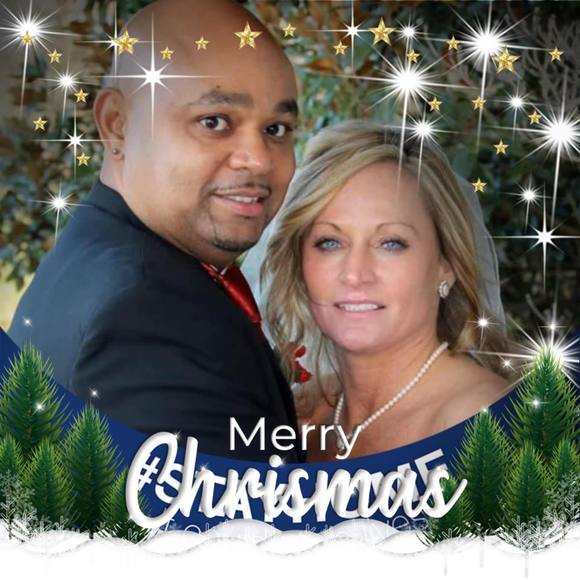
Identify the location of fake bright white lights. (558, 141), (545, 366), (34, 32), (148, 78).